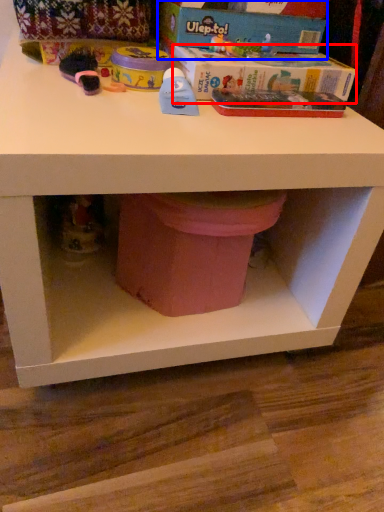
Question: Which of the following is the farthest to the observer, box (highlighted by a red box) or box (highlighted by a blue box)?

Choices:
 (A) box
 (B) box

Answer: (B)